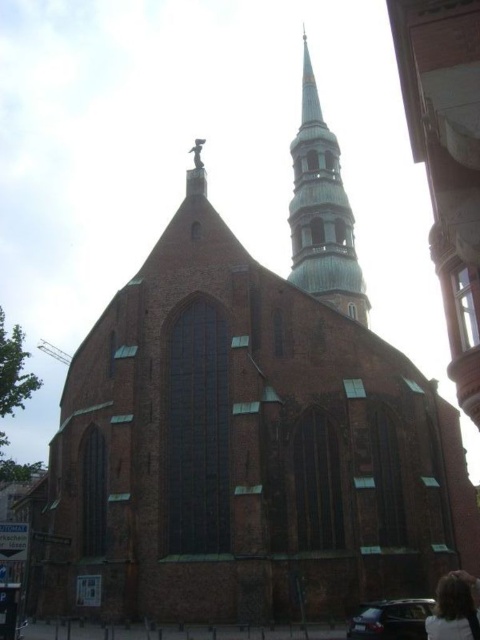
Is point (338, 298) positioned before point (459, 632)?

That is False.

Is green copper spire at upper center closer to the viewer compared to blonde hair at lower right?

That is False.

In order to click on green copper spire at upper center in this screenshot , I will do `click(322, 211)`.